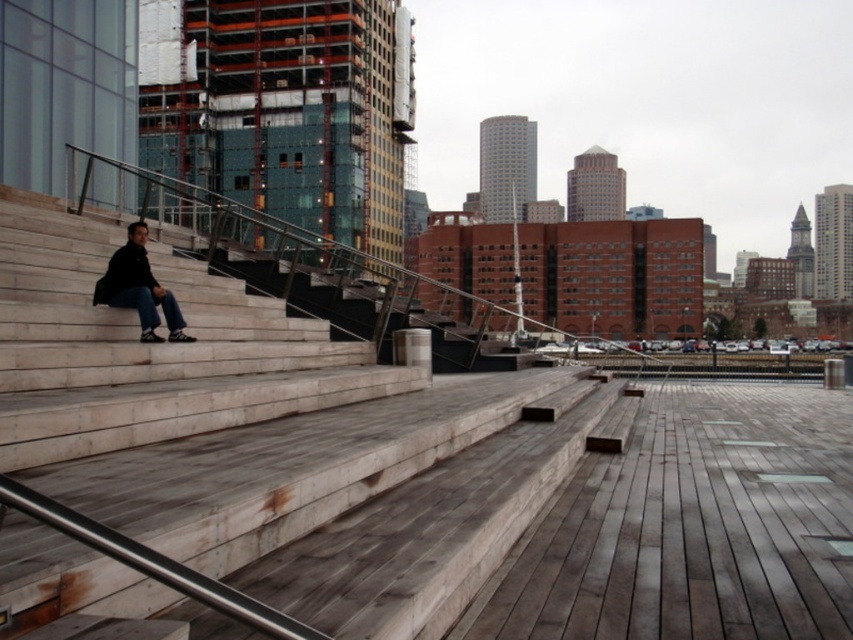
Question: Which object appears closest to the camera in this image?

Choices:
 (A) dark blue jeans at left
 (B) wooden stairs at left

Answer: (B)

Question: Which point is closer to the camera?

Choices:
 (A) (157, 337)
 (B) (154, 509)

Answer: (B)

Question: Is wooden stairs at left positioned in front of dark blue jeans at left?

Choices:
 (A) yes
 (B) no

Answer: (A)

Question: Can you confirm if wooden stairs at left is bigger than dark blue jeans at left?

Choices:
 (A) no
 (B) yes

Answer: (A)

Question: Does wooden stairs at left appear over dark blue jeans at left?

Choices:
 (A) yes
 (B) no

Answer: (B)